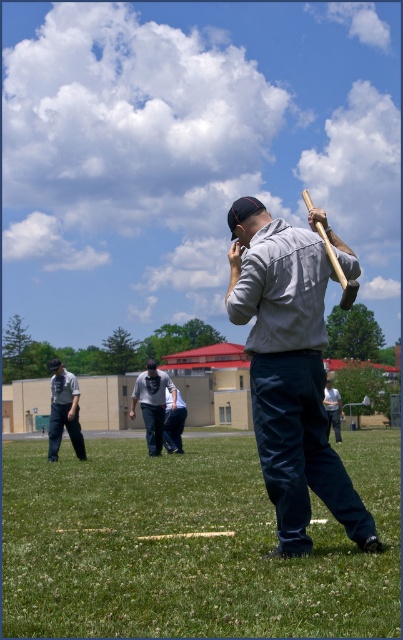
Question: Can you confirm if dark gray uniform at lower left is positioned to the right of light gray shirt at center?

Choices:
 (A) yes
 (B) no

Answer: (B)

Question: Is matte gray shirt at center to the left of light gray shirt at center from the viewer's perspective?

Choices:
 (A) yes
 (B) no

Answer: (A)

Question: Can you confirm if matte gray shirt at center is wider than dark gray shirt at center?

Choices:
 (A) no
 (B) yes

Answer: (A)

Question: Estimate the real-world distances between objects in this image. Which object is farther from the light gray shirt at center?

Choices:
 (A) dark gray shirt at center
 (B) matte gray shirt at center
 (C) dark gray uniform at lower left
 (D) dark blue jeans at center

Answer: (B)

Question: Estimate the real-world distances between objects in this image. Which object is closer to the light gray shirt at center?

Choices:
 (A) green grass at lower center
 (B) dark blue jeans at center
 (C) matte gray shirt at center
 (D) dark gray uniform at lower left

Answer: (A)

Question: Which point appears farthest from the camera in this image?

Choices:
 (A) (174, 444)
 (B) (270, 332)

Answer: (A)